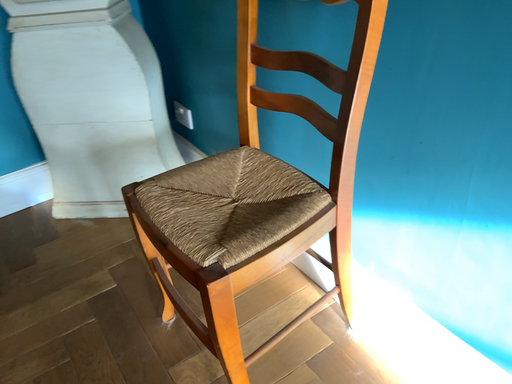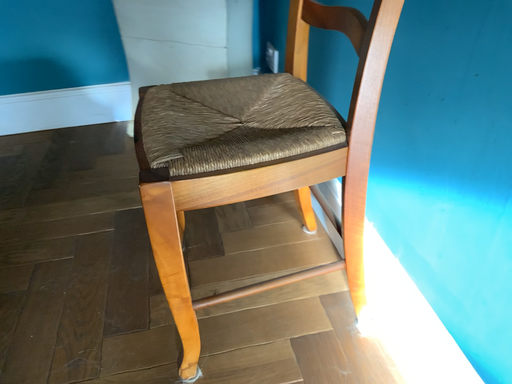
Question: Which way did the camera rotate in the video?

Choices:
 (A) rotated right
 (B) rotated left

Answer: (B)